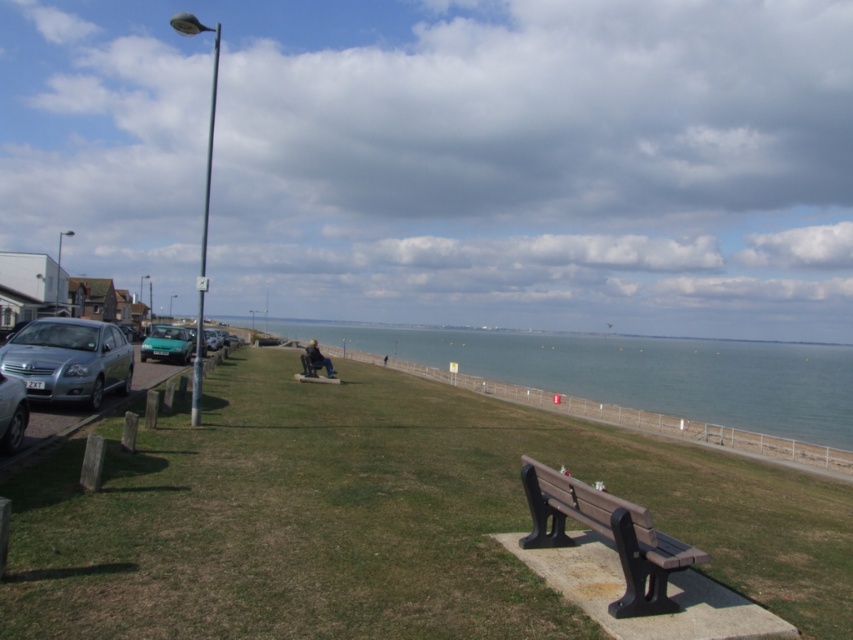
You are standing at the entrance of the park and want to sit on one of the benches. Which bench, the brown wood bench at lower right or the brown wooden bench at center, is nearer to you?

The brown wood bench at lower right is closer to the viewer than the brown wooden bench at center, so it is nearer to you.

You are a photographer trying to capture a landscape shot of the blue water at center and the shiny silver car at left. Which object appears larger in the photo?

The blue water at center appears larger in the photo because it is much taller than the shiny silver car at left.